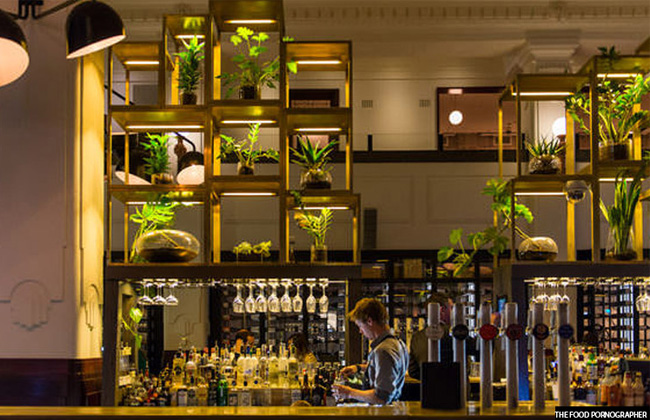
This screenshot has height=420, width=650. In order to click on light in this screenshot , I will do pos(101,43).